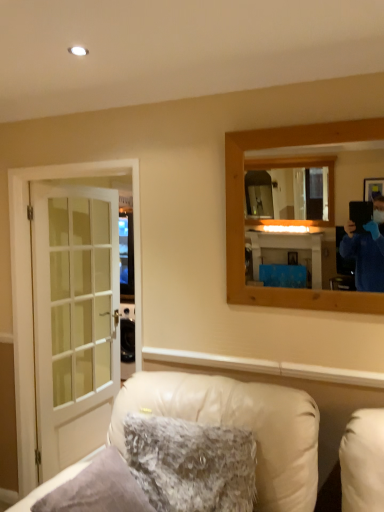
Question: Is fuzzy fabric pillow at lower center positioned beyond the bounds of white glass door at left?

Choices:
 (A) no
 (B) yes

Answer: (B)

Question: Is fuzzy fabric pillow at lower center shorter than white glass door at left?

Choices:
 (A) no
 (B) yes

Answer: (B)

Question: Are fuzzy fabric pillow at lower center and white glass door at left located far from each other?

Choices:
 (A) no
 (B) yes

Answer: (B)

Question: Is the depth of fuzzy fabric pillow at lower center greater than that of white glass door at left?

Choices:
 (A) no
 (B) yes

Answer: (A)

Question: Does fuzzy fabric pillow at lower center have a smaller size compared to white glass door at left?

Choices:
 (A) no
 (B) yes

Answer: (B)

Question: Is white glass door at left wider or thinner than white leather chair at lower center?

Choices:
 (A) thin
 (B) wide

Answer: (A)

Question: Looking at the image, does white glass door at left seem bigger or smaller compared to white leather chair at lower center?

Choices:
 (A) big
 (B) small

Answer: (B)

Question: Considering their positions, is white glass door at left located in front of or behind white leather chair at lower center?

Choices:
 (A) behind
 (B) front

Answer: (A)

Question: Would you say white glass door at left is inside or outside white leather chair at lower center?

Choices:
 (A) inside
 (B) outside

Answer: (B)

Question: Would you say white leather chair at lower center is to the left or to the right of white glass door at left in the picture?

Choices:
 (A) right
 (B) left

Answer: (A)

Question: In terms of size, does white leather chair at lower center appear bigger or smaller than white glass door at left?

Choices:
 (A) big
 (B) small

Answer: (A)

Question: In terms of width, does white leather chair at lower center look wider or thinner when compared to white glass door at left?

Choices:
 (A) thin
 (B) wide

Answer: (B)

Question: Considering their positions, is white leather chair at lower center located in front of or behind white glass door at left?

Choices:
 (A) front
 (B) behind

Answer: (A)

Question: In terms of width, does white leather chair at lower center look wider or thinner when compared to fuzzy fabric pillow at lower center?

Choices:
 (A) thin
 (B) wide

Answer: (B)

Question: Based on their sizes in the image, would you say white leather chair at lower center is bigger or smaller than fuzzy fabric pillow at lower center?

Choices:
 (A) small
 (B) big

Answer: (B)